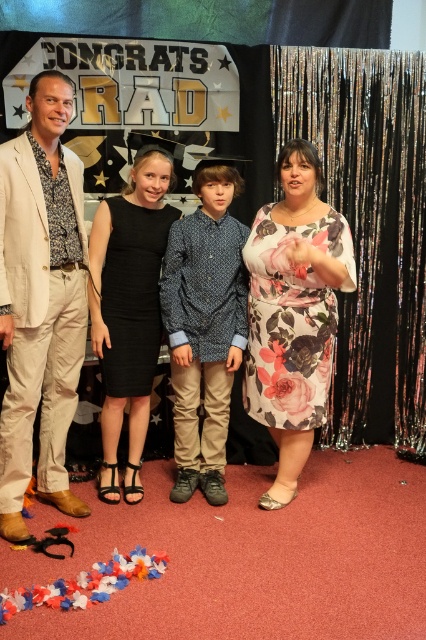
Which is in front, point (69, 81) or point (216, 177)?

Point (69, 81) is more forward.

Is beige cotton blazer at left thinner than blue printed shirt at center?

Indeed, beige cotton blazer at left has a lesser width compared to blue printed shirt at center.

Where is `beige cotton blazer at left`? The width and height of the screenshot is (426, 640). beige cotton blazer at left is located at coordinates (40, 300).

Looking at this image, does blue printed shirt at center have a greater height compared to black satin dress at center?

In fact, blue printed shirt at center may be shorter than black satin dress at center.

Which is more to the right, blue printed shirt at center or black satin dress at center?

From the viewer's perspective, blue printed shirt at center appears more on the right side.

Does point (192, 292) come farther from viewer compared to point (127, 483)?

No, (192, 292) is in front of (127, 483).

You are a GUI agent. You are given a task and a screenshot of the screen. Output one action in this format:
    pyautogui.click(x=<x>, y=<y>)
    Task: Click on the blue printed shirt at center
    
    Given the screenshot: What is the action you would take?
    coord(204,326)

You are a GUI agent. You are given a task and a screenshot of the screen. Output one action in this format:
    pyautogui.click(x=<x>, y=<y>)
    Task: Click on the floral fabric dress at center
    This screenshot has width=426, height=640.
    Given the screenshot: What is the action you would take?
    [49, 113]

Who is more forward, (x=161, y=179) or (x=108, y=256)?

Point (x=161, y=179)

The width and height of the screenshot is (426, 640). In order to click on floral fabric dress at center in this screenshot , I will do `click(49, 113)`.